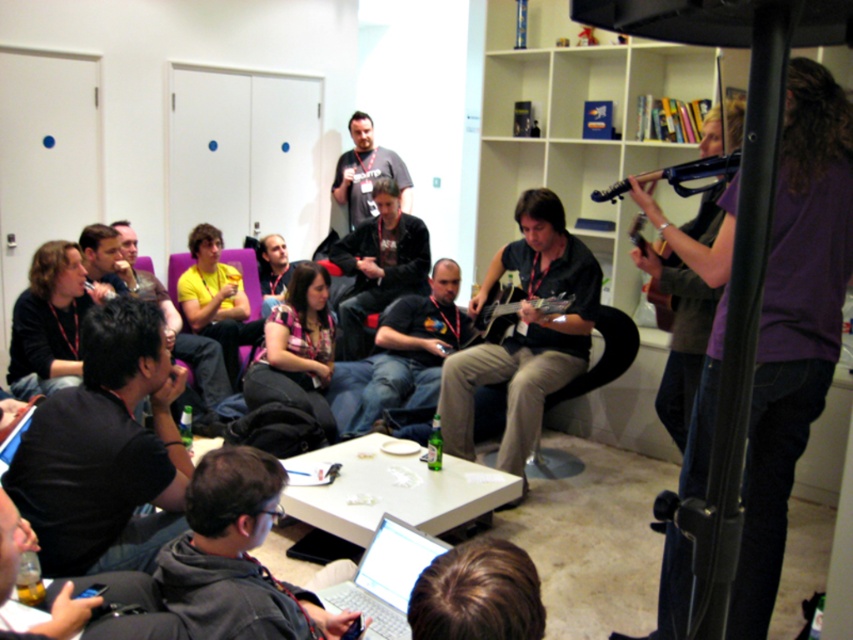
Question: Among these objects, which one is farthest from the camera?

Choices:
 (A) purple fabric armchair at center
 (B) metallic guitar at center
 (C) black fabric shirt at center

Answer: (A)

Question: Which point is closer to the camera taking this photo?

Choices:
 (A) (410, 253)
 (B) (28, 417)
 (C) (355, 212)

Answer: (B)

Question: Does black fabric shirt at center have a lesser width compared to matte black guitar at upper right?

Choices:
 (A) no
 (B) yes

Answer: (A)

Question: Does black fabric shirt at center have a greater width compared to dark gray t-shirt at upper center?

Choices:
 (A) yes
 (B) no

Answer: (B)

Question: Estimate the real-world distances between objects in this image. Which object is farther from the matte black guitar at upper right?

Choices:
 (A) purple fabric armchair at center
 (B) black matte shirt at lower left
 (C) dark gray t-shirt at upper center

Answer: (C)

Question: Can you confirm if gray hoodie at lower center is positioned below matte black laptop at lower left?

Choices:
 (A) no
 (B) yes

Answer: (B)